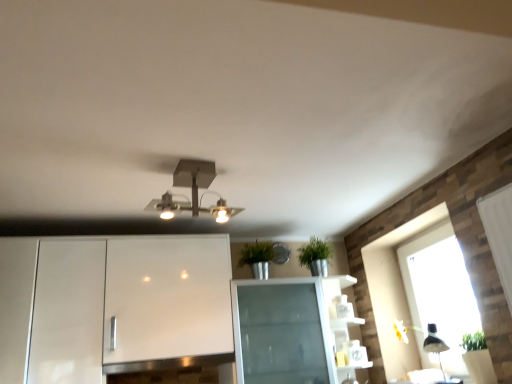
Image resolution: width=512 pixels, height=384 pixels. In order to click on metallic square light fixture at center in this screenshot , I will do `click(193, 192)`.

Identify the location of transparent glass window at right. (394, 291).

Are transparent glass window at right and metallic square light fixture at center located far from each other?

Yes.

Consider the image. In terms of height, does transparent glass window at right look taller or shorter compared to metallic square light fixture at center?

transparent glass window at right is taller than metallic square light fixture at center.

Is transparent glass window at right at the left side of metallic square light fixture at center?

No, transparent glass window at right is not to the left of metallic square light fixture at center.

How many degrees apart are the facing directions of transparent glass window at right and metallic square light fixture at center?

The angle between the facing direction of transparent glass window at right and the facing direction of metallic square light fixture at center is 102 degrees.

Can we say metallic square light fixture at center lies outside black matte lamp at lower right?

metallic square light fixture at center lies outside black matte lamp at lower right's area.

Considering the positions of points (188, 167) and (431, 346), is point (188, 167) farther from camera compared to point (431, 346)?

No.

Can you confirm if metallic square light fixture at center is taller than black matte lamp at lower right?

No.

Is metallic square light fixture at center to the left of black matte lamp at lower right from the viewer's perspective?

Indeed, metallic square light fixture at center is positioned on the left side of black matte lamp at lower right.

Where is `lamp that appears above the black matte lamp at lower right (from a real-world perspective)`? lamp that appears above the black matte lamp at lower right (from a real-world perspective) is located at coordinates (193, 192).

Is black matte lamp at lower right beside metallic square light fixture at center?

No, black matte lamp at lower right is not beside metallic square light fixture at center.

Is point (440, 359) closer or farther from the camera than point (222, 199)?

Point (440, 359) appears to be farther away from the viewer than point (222, 199).

Could you tell me if black matte lamp at lower right is turned towards metallic square light fixture at center?

Yes, black matte lamp at lower right is turned towards metallic square light fixture at center.

Measure the distance between black matte lamp at lower right and transparent glass window at right.

A distance of 8.99 inches exists between black matte lamp at lower right and transparent glass window at right.

Which of these two, black matte lamp at lower right or transparent glass window at right, stands taller?

transparent glass window at right is taller.

Could you tell me if black matte lamp at lower right is facing transparent glass window at right?

No.

Considering the positions of objects black matte lamp at lower right and transparent glass window at right in the image provided, who is behind, black matte lamp at lower right or transparent glass window at right?

transparent glass window at right is further away from the camera.

Is transparent glass window at right outside of black matte lamp at lower right?

That's correct, transparent glass window at right is outside of black matte lamp at lower right.

Can you tell me how much transparent glass window at right and black matte lamp at lower right differ in facing direction?

0.943 degrees.

Measure the distance between transparent glass window at right and black matte lamp at lower right.

transparent glass window at right is 8.99 inches away from black matte lamp at lower right.

Is transparent glass window at right oriented away from black matte lamp at lower right?

Yes, transparent glass window at right's orientation is away from black matte lamp at lower right.

In terms of height, does metallic square light fixture at center look taller or shorter compared to transparent glass window at right?

Considering their sizes, metallic square light fixture at center has less height than transparent glass window at right.

Based on the photo, from the image's perspective, does metallic square light fixture at center appear lower than transparent glass window at right?

No, from the image's perspective, metallic square light fixture at center is not below transparent glass window at right.

Could you tell me if metallic square light fixture at center is facing transparent glass window at right?

No, metallic square light fixture at center is not facing towards transparent glass window at right.

Visually, is metallic square light fixture at center positioned to the left or to the right of transparent glass window at right?

From the image, it's evident that metallic square light fixture at center is to the left of transparent glass window at right.

I want to click on lamp in front of the transparent glass window at right, so [193, 192].

The image size is (512, 384). What are the coordinates of `light fixture below the metallic square light fixture at center (from the image's perspective)` in the screenshot? It's located at (435, 345).

Looking at the image, which one is located closer to black matte lamp at lower right, metallic square light fixture at center or transparent glass window at right?

→ transparent glass window at right is positioned closer to the anchor black matte lamp at lower right.

In the scene shown: Considering their positions, is metallic square light fixture at center positioned closer to transparent glass window at right than black matte lamp at lower right?

black matte lamp at lower right is positioned closer to the anchor transparent glass window at right.

From the image, which object appears to be nearer to transparent glass window at right, black matte lamp at lower right or metallic square light fixture at center?

black matte lamp at lower right.

From the image, which object appears to be nearer to metallic square light fixture at center, black matte lamp at lower right or transparent glass window at right?

Based on the image, transparent glass window at right appears to be nearer to metallic square light fixture at center.

Considering their positions, is transparent glass window at right positioned further to metallic square light fixture at center than black matte lamp at lower right?

black matte lamp at lower right.

Which object lies nearer to the anchor point black matte lamp at lower right, transparent glass window at right or metallic square light fixture at center?

transparent glass window at right is closer to black matte lamp at lower right.

The height and width of the screenshot is (384, 512). In order to click on light fixture situated between metallic square light fixture at center and transparent glass window at right from left to right in this screenshot , I will do `click(435, 345)`.